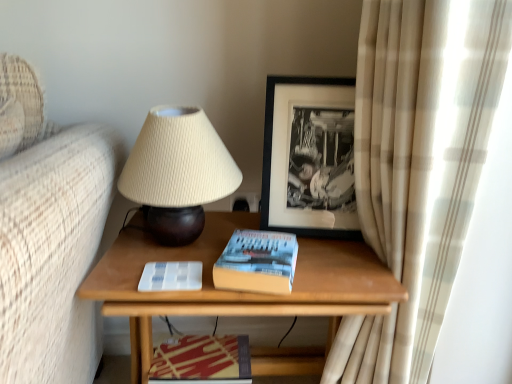
You are a GUI agent. You are given a task and a screenshot of the screen. Output one action in this format:
    pyautogui.click(x=<x>, y=<y>)
    Task: Click on the blank space above wooden table at center (from a real-world perspective)
    
    Given the screenshot: What is the action you would take?
    pyautogui.click(x=260, y=232)